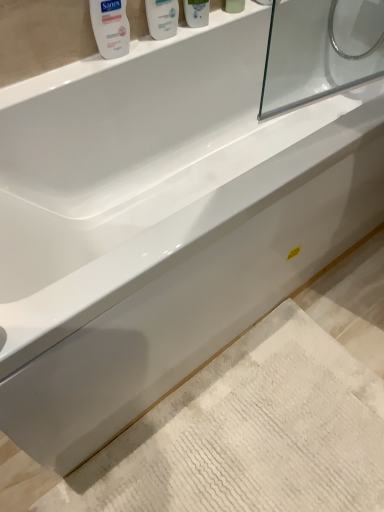
Question: Is white glossy bottle at upper center, the 3th mouthwash when ordered from left to right, at the right side of white glossy mouthwash at upper left, the fourth mouthwash from the right?

Choices:
 (A) no
 (B) yes

Answer: (B)

Question: Is white glossy bottle at upper center, marked as the 2th mouthwash in a right-to-left arrangement, closer to camera compared to white glossy mouthwash at upper left, the fourth mouthwash from the right?

Choices:
 (A) no
 (B) yes

Answer: (A)

Question: Is white glossy bottle at upper center, the 3th mouthwash when ordered from left to right, facing towards white glossy mouthwash at upper left, the fourth mouthwash from the right?

Choices:
 (A) no
 (B) yes

Answer: (A)

Question: Does white glossy bottle at upper center, the 3th mouthwash when ordered from left to right, lie behind white glossy mouthwash at upper left, the fourth mouthwash from the right?

Choices:
 (A) no
 (B) yes

Answer: (B)

Question: Would you say white glossy mouthwash at upper left, the fourth mouthwash from the right, is part of white glossy bottle at upper center, the 3th mouthwash when ordered from left to right,'s contents?

Choices:
 (A) no
 (B) yes

Answer: (A)

Question: Is white glossy bottle at upper center, the 3th mouthwash when ordered from left to right, positioned far away from white glossy mouthwash at upper left, which ranks as the 1th mouthwash in left-to-right order?

Choices:
 (A) yes
 (B) no

Answer: (B)

Question: Considering the relative sizes of white glossy bottle at upper center, the 3th mouthwash when ordered from left to right, and white textured bath mat at lower center in the image provided, is white glossy bottle at upper center, the 3th mouthwash when ordered from left to right, taller than white textured bath mat at lower center?

Choices:
 (A) yes
 (B) no

Answer: (A)

Question: Considering the relative positions of white glossy bottle at upper center, the 3th mouthwash when ordered from left to right, and white textured bath mat at lower center in the image provided, is white glossy bottle at upper center, the 3th mouthwash when ordered from left to right, to the right of white textured bath mat at lower center from the viewer's perspective?

Choices:
 (A) no
 (B) yes

Answer: (A)

Question: From a real-world perspective, does white glossy bottle at upper center, the 3th mouthwash when ordered from left to right, sit lower than white textured bath mat at lower center?

Choices:
 (A) no
 (B) yes

Answer: (A)

Question: Is white glossy bottle at upper center, marked as the 2th mouthwash in a right-to-left arrangement, in front of white textured bath mat at lower center?

Choices:
 (A) no
 (B) yes

Answer: (A)

Question: Can white textured bath mat at lower center be found inside white glossy bottle at upper center, the 3th mouthwash when ordered from left to right?

Choices:
 (A) no
 (B) yes

Answer: (A)

Question: Is white glossy bottle at upper center, the 3th mouthwash when ordered from left to right, in contact with white textured bath mat at lower center?

Choices:
 (A) yes
 (B) no

Answer: (B)

Question: Does white glossy mouthwash at upper center, which is the 3th mouthwash in right-to-left order, have a lesser width compared to white glossy mouthwash at upper left, the fourth mouthwash from the right?

Choices:
 (A) no
 (B) yes

Answer: (A)